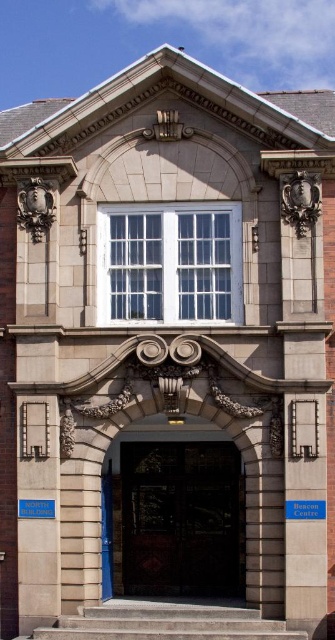
Is dark wood door at center positioned behind concrete stairs at center?

Yes.

Can you confirm if dark wood door at center is taller than concrete stairs at center?

Yes.

The width and height of the screenshot is (335, 640). Describe the element at coordinates (181, 518) in the screenshot. I see `dark wood door at center` at that location.

Where is `dark wood door at center`? Image resolution: width=335 pixels, height=640 pixels. dark wood door at center is located at coordinates (181, 518).